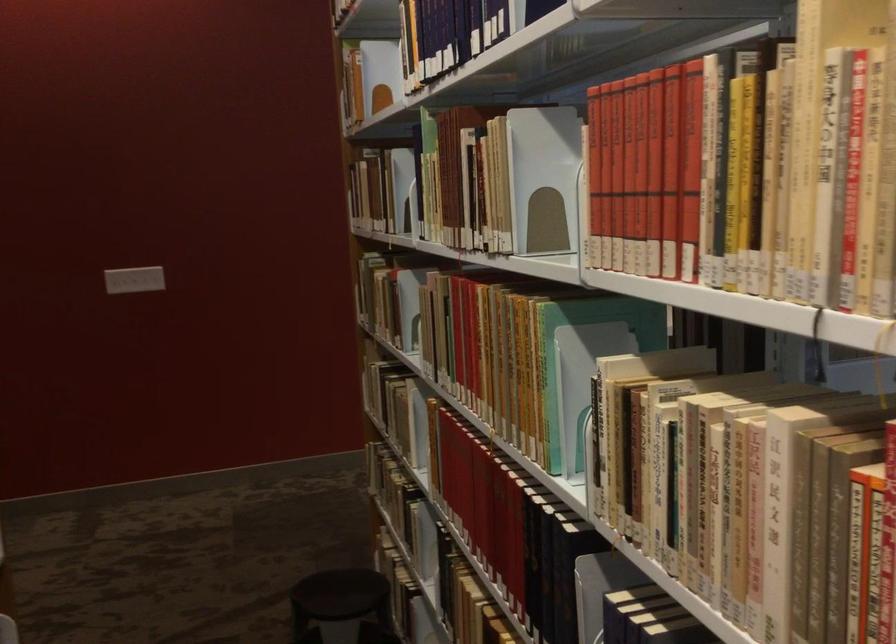
Image resolution: width=896 pixels, height=644 pixels. In order to click on red book in this screenshot , I will do `click(633, 172)`.